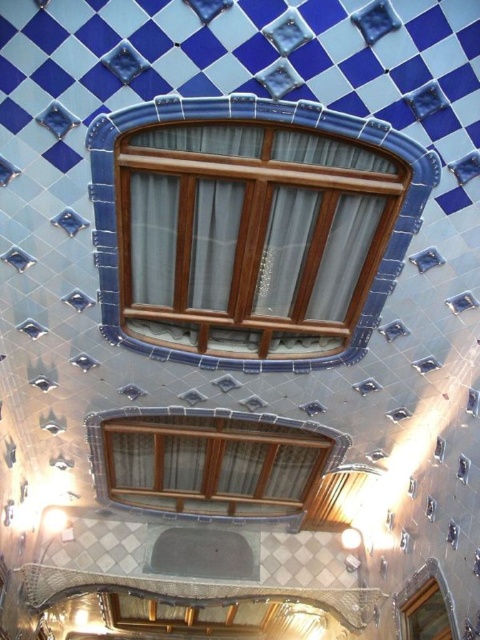
Looking at this image, between wooden frame at center and matte wood window at center, which one has less height?

With less height is matte wood window at center.

How far apart are wooden frame at center and matte wood window at center?

wooden frame at center and matte wood window at center are 12.36 feet apart from each other.

Which is in front, point (186, 145) or point (151, 477)?

Positioned in front is point (186, 145).

Image resolution: width=480 pixels, height=640 pixels. I want to click on wooden frame at center, so [249, 230].